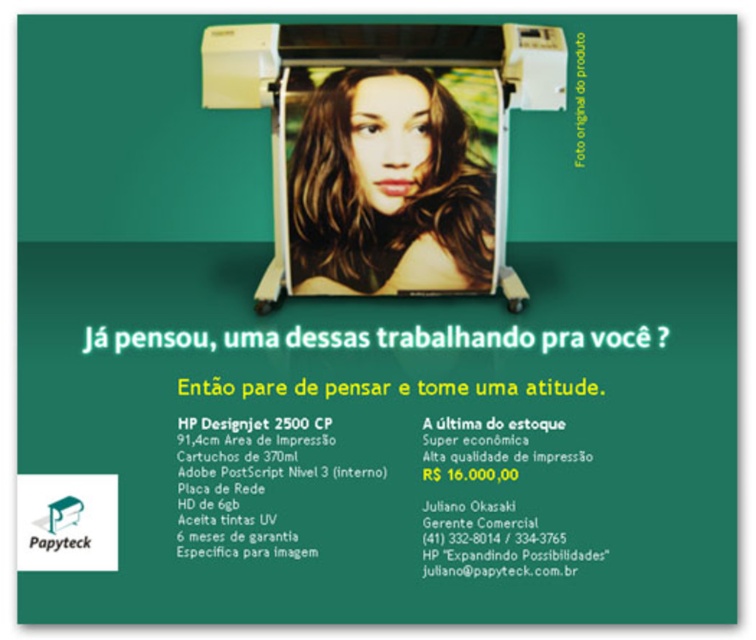
You are designing a poster and need to ensure that the white plastic printer at center and the shiny brown hair at center are not too close to each other. According to the provided description, what is the minimum distance you should keep between them?

The minimum distance you should keep between the white plastic printer at center and the shiny brown hair at center is 2.72 centimeters, as they are currently 2.72 centimeters apart.

In the advertisement for the HP Designjet 2500 CP printer, you notice a white plastic printer at center and a shiny brown hair at center. Which object is positioned higher up in the image?

The white plastic printer at center is taller than shiny brown hair at center, so it is positioned higher up in the image.

In the advertisement for the HP Designjet 2500 CP printer, you see a point labeled as point (386, 129). What does this point indicate?

The point (386, 129) indicates the location of the white plastic printer at center in the advertisement.